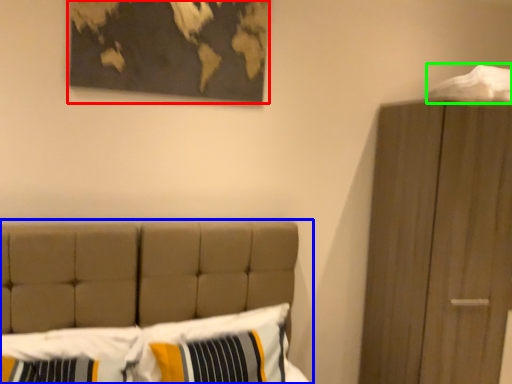
Question: Which object is the farthest from picture frame (highlighted by a red box)? Choose among these: bed (highlighted by a blue box) or sheet (highlighted by a green box).

Choices:
 (A) bed
 (B) sheet

Answer: (B)